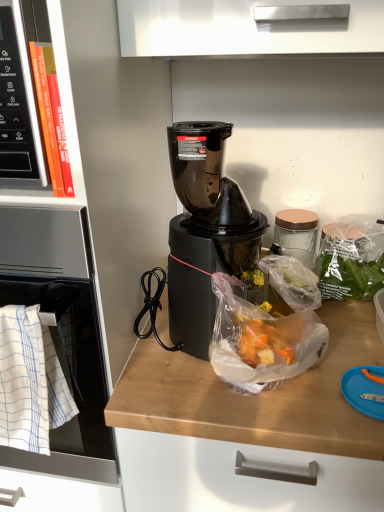
Question: Does white woven towel at left have a lesser width compared to orange hardcover book at left?

Choices:
 (A) yes
 (B) no

Answer: (B)

Question: Could you tell me if white woven towel at left is turned towards orange hardcover book at left?

Choices:
 (A) no
 (B) yes

Answer: (A)

Question: Considering the relative positions of white woven towel at left and orange hardcover book at left in the image provided, is white woven towel at left to the left of orange hardcover book at left from the viewer's perspective?

Choices:
 (A) no
 (B) yes

Answer: (B)

Question: Can you confirm if white woven towel at left is positioned to the right of orange hardcover book at left?

Choices:
 (A) no
 (B) yes

Answer: (A)

Question: Is white woven towel at left not inside orange hardcover book at left?

Choices:
 (A) yes
 (B) no

Answer: (A)

Question: Is white woven towel at left shorter than orange hardcover book at left?

Choices:
 (A) no
 (B) yes

Answer: (A)

Question: Is black plastic blender at center closer to camera compared to white woven towel at left?

Choices:
 (A) yes
 (B) no

Answer: (B)

Question: Considering the relative positions of black plastic blender at center and white woven towel at left in the image provided, is black plastic blender at center behind white woven towel at left?

Choices:
 (A) yes
 (B) no

Answer: (A)

Question: Is black plastic blender at center shorter than white woven towel at left?

Choices:
 (A) yes
 (B) no

Answer: (B)

Question: Is black plastic blender at center oriented towards white woven towel at left?

Choices:
 (A) yes
 (B) no

Answer: (B)

Question: Is black plastic blender at center smaller than white woven towel at left?

Choices:
 (A) yes
 (B) no

Answer: (B)

Question: Can you confirm if black plastic blender at center is wider than white woven towel at left?

Choices:
 (A) yes
 (B) no

Answer: (A)

Question: Is white woven towel at left far from translucent plastic bag at center?

Choices:
 (A) yes
 (B) no

Answer: (B)